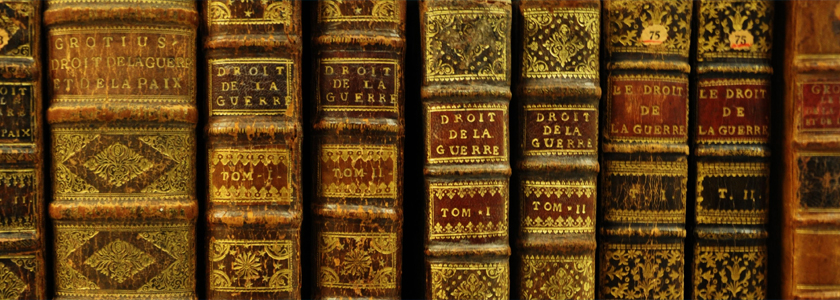
Where is `book`? Image resolution: width=840 pixels, height=300 pixels. book is located at coordinates coord(24,86), coord(123,92), coord(238,82), coord(318,98), coord(447,94), coord(536,105), coord(625,114), coord(714,121), coord(799,117).